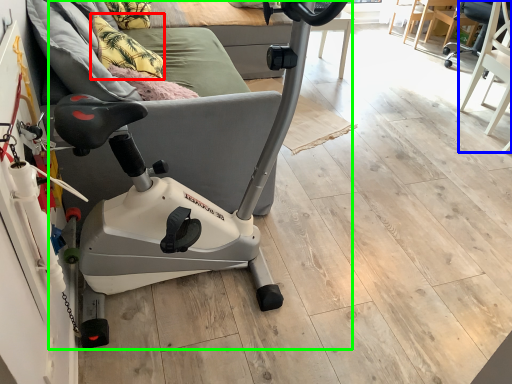
Question: Estimate the real-world distances between objects in this image. Which object is farther from pillow (highlighted by a red box), swivel chair (highlighted by a blue box) or stationary bicycle (highlighted by a green box)?

Choices:
 (A) swivel chair
 (B) stationary bicycle

Answer: (A)